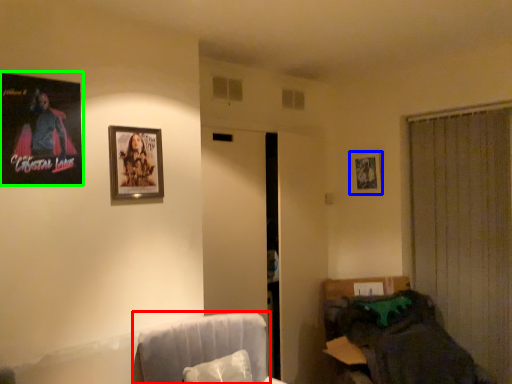
Question: Based on their relative distances, which object is nearer to swivel chair (highlighted by a red box)? Choose from picture frame (highlighted by a blue box) and picture frame (highlighted by a green box).

Choices:
 (A) picture frame
 (B) picture frame

Answer: (B)